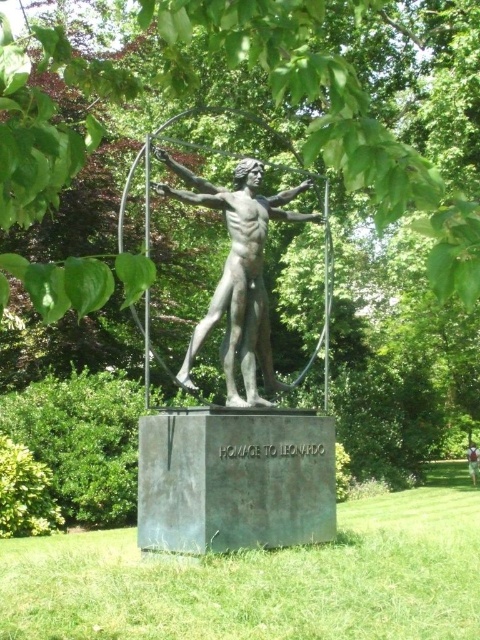
Question: From the image, what is the correct spatial relationship of bronze statue at center in relation to light brown fabric shirt at center?

Choices:
 (A) right
 (B) left

Answer: (B)

Question: Does bronze statue at center appear on the left side of light brown fabric shirt at center?

Choices:
 (A) no
 (B) yes

Answer: (B)

Question: Can you confirm if bronze statue at center is positioned below light brown fabric shirt at center?

Choices:
 (A) no
 (B) yes

Answer: (A)

Question: Which object is farther from the camera taking this photo?

Choices:
 (A) bronze statue at center
 (B) light brown fabric shirt at center

Answer: (B)

Question: Which of the following is the farthest from the observer?

Choices:
 (A) (245, 180)
 (B) (478, 460)

Answer: (B)